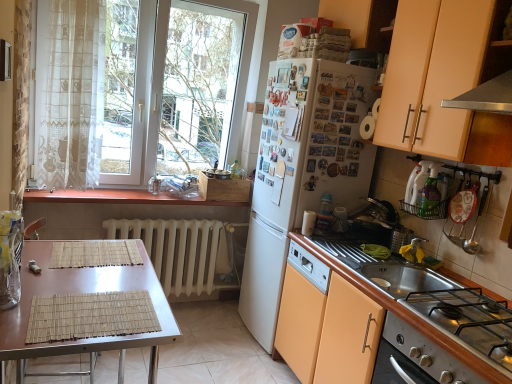
Question: From the image's perspective, does stainless steel gas stove at lower right appear lower than white glossy cup at upper center, placed as the first appliance when sorted from bottom to top?

Choices:
 (A) no
 (B) yes

Answer: (B)

Question: Considering the relative positions of stainless steel gas stove at lower right and white glossy cup at upper center, which is counted as the 1th appliance, starting from the left, in the image provided, is stainless steel gas stove at lower right to the right of white glossy cup at upper center, which is counted as the 1th appliance, starting from the left, from the viewer's perspective?

Choices:
 (A) no
 (B) yes

Answer: (B)

Question: Is stainless steel gas stove at lower right thinner than white glossy cup at upper center, which is counted as the 1th appliance, starting from the left?

Choices:
 (A) yes
 (B) no

Answer: (B)

Question: Does stainless steel gas stove at lower right appear on the left side of white glossy cup at upper center, which is counted as the 1th appliance, starting from the left?

Choices:
 (A) no
 (B) yes

Answer: (A)

Question: Considering the relative sizes of stainless steel gas stove at lower right and white glossy cup at upper center, which is counted as the 1th appliance, starting from the left, in the image provided, is stainless steel gas stove at lower right shorter than white glossy cup at upper center, which is counted as the 1th appliance, starting from the left,?

Choices:
 (A) yes
 (B) no

Answer: (A)

Question: From the image's perspective, relative to brown bamboo placemat at lower left, is white glass window at upper left above or below?

Choices:
 (A) above
 (B) below

Answer: (A)

Question: Is white glass window at upper left to the left or to the right of brown bamboo placemat at lower left in the image?

Choices:
 (A) left
 (B) right

Answer: (B)

Question: Based on their sizes in the image, would you say white glass window at upper left is bigger or smaller than brown bamboo placemat at lower left?

Choices:
 (A) small
 (B) big

Answer: (B)

Question: Considering their positions, is white glass window at upper left located in front of or behind brown bamboo placemat at lower left?

Choices:
 (A) behind
 (B) front

Answer: (A)

Question: In terms of height, does matte peach cabinet at upper right, the first cabinetry from the top, look taller or shorter compared to stainless steel gas stove at lower right?

Choices:
 (A) tall
 (B) short

Answer: (A)

Question: From the image's perspective, is matte peach cabinet at upper right, acting as the 2th cabinetry starting from the bottom, above or below stainless steel gas stove at lower right?

Choices:
 (A) below
 (B) above

Answer: (B)

Question: In terms of width, does matte peach cabinet at upper right, acting as the 2th cabinetry starting from the bottom, look wider or thinner when compared to stainless steel gas stove at lower right?

Choices:
 (A) thin
 (B) wide

Answer: (A)

Question: Visually, is matte peach cabinet at upper right, the first cabinetry from the top, positioned to the left or to the right of stainless steel gas stove at lower right?

Choices:
 (A) right
 (B) left

Answer: (A)

Question: Considering the positions of white glass window at upper left and clear glass jar at left in the image, is white glass window at upper left taller or shorter than clear glass jar at left?

Choices:
 (A) tall
 (B) short

Answer: (A)

Question: Relative to clear glass jar at left, is white glass window at upper left in front or behind?

Choices:
 (A) front
 (B) behind

Answer: (B)